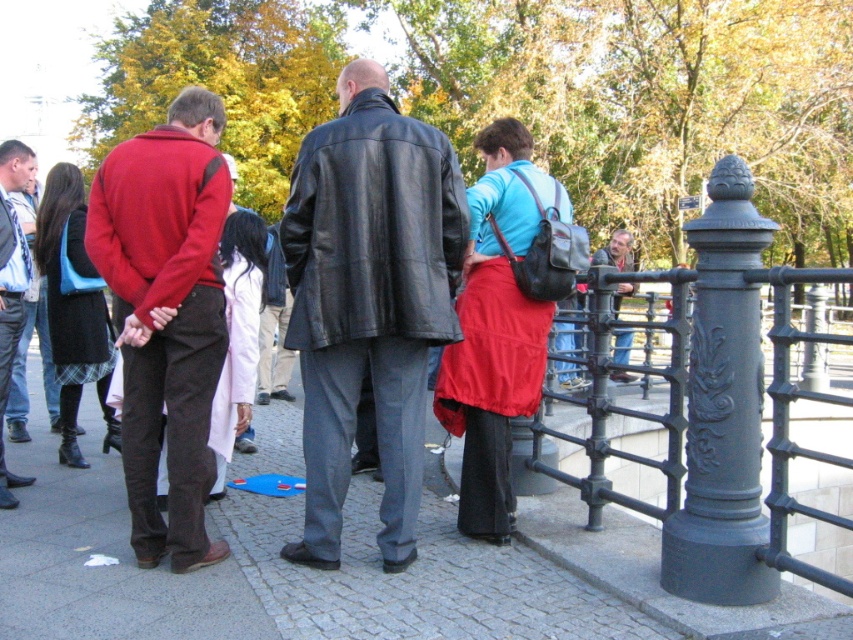
Is black leather jacket at center bigger than blue jeans at right?

Actually, black leather jacket at center might be smaller than blue jeans at right.

Between point (439, 154) and point (625, 378), which one is positioned behind?

Positioned behind is point (625, 378).

You are a GUI agent. You are given a task and a screenshot of the screen. Output one action in this format:
    pyautogui.click(x=<x>, y=<y>)
    Task: Click on the black leather jacket at center
    
    Given the screenshot: What is the action you would take?
    pyautogui.click(x=373, y=228)

Does matte black jacket at left have a greater width compared to blue jeans at right?

No, matte black jacket at left is not wider than blue jeans at right.

Does matte black jacket at left have a lesser width compared to blue jeans at right?

Yes.

Describe the element at coordinates (10, 284) in the screenshot. Image resolution: width=853 pixels, height=640 pixels. I see `matte black jacket at left` at that location.

Where is `matte black jacket at left`? The width and height of the screenshot is (853, 640). matte black jacket at left is located at coordinates (10, 284).

Between matte red sweater at left and matte red jacket at left, which one has more height?

Standing taller between the two is matte red sweater at left.

Locate an element on the screen. The image size is (853, 640). matte red sweater at left is located at coordinates (165, 316).

The height and width of the screenshot is (640, 853). In order to click on matte red sweater at left in this screenshot , I will do `click(165, 316)`.